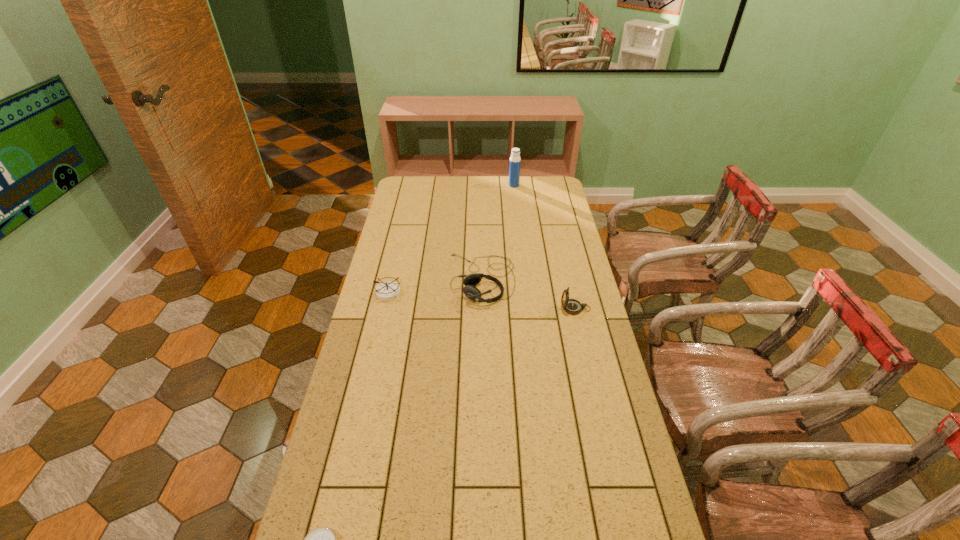
Image resolution: width=960 pixels, height=540 pixels. What are the coordinates of `water bottle` in the screenshot? It's located at (515, 161).

This screenshot has height=540, width=960. In order to click on the tallest object in this screenshot , I will do `click(515, 161)`.

Locate an element on the screen. the second nearest compass is located at coordinates (571, 306).

What are the coordinates of `the rightmost compass` in the screenshot? It's located at (571, 306).

Locate an element on the screen. This screenshot has height=540, width=960. headset is located at coordinates (471, 292).

At what (x,y) coordinates should I click in order to perform the action: click on the third object from left to right. Please return your answer as a coordinate pair (x, y). The width and height of the screenshot is (960, 540). Looking at the image, I should click on [x=471, y=292].

The width and height of the screenshot is (960, 540). I want to click on the fourth tallest object, so click(387, 291).

Image resolution: width=960 pixels, height=540 pixels. In order to click on the second tallest compass in this screenshot , I will do `click(387, 291)`.

At what (x,y) coordinates should I click in order to perform the action: click on vacant space located 0.210m on the right of the farthest object. Please return your answer as a coordinate pair (x, y). This screenshot has width=960, height=540. Looking at the image, I should click on (560, 185).

Find the location of a particular element. The height and width of the screenshot is (540, 960). free space located 0.370m on the face of the rightmost object is located at coordinates (460, 308).